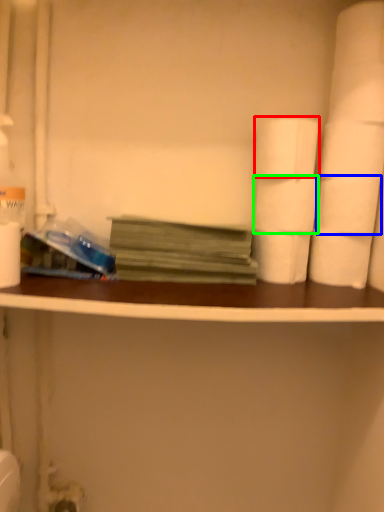
Question: Based on their relative distances, which object is nearer to toilet paper (highlighted by a red box)? Choose from toilet paper (highlighted by a blue box) and toilet paper (highlighted by a green box).

Choices:
 (A) toilet paper
 (B) toilet paper

Answer: (B)